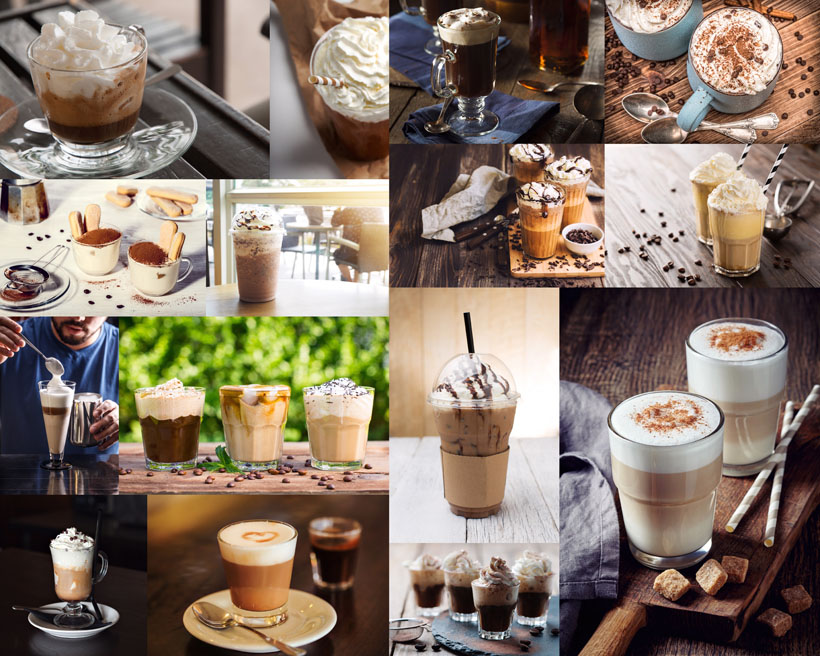
Locate an element on the screen. photos on the left side of the collage is located at coordinates (89, 138), (61, 222), (47, 388), (65, 536).